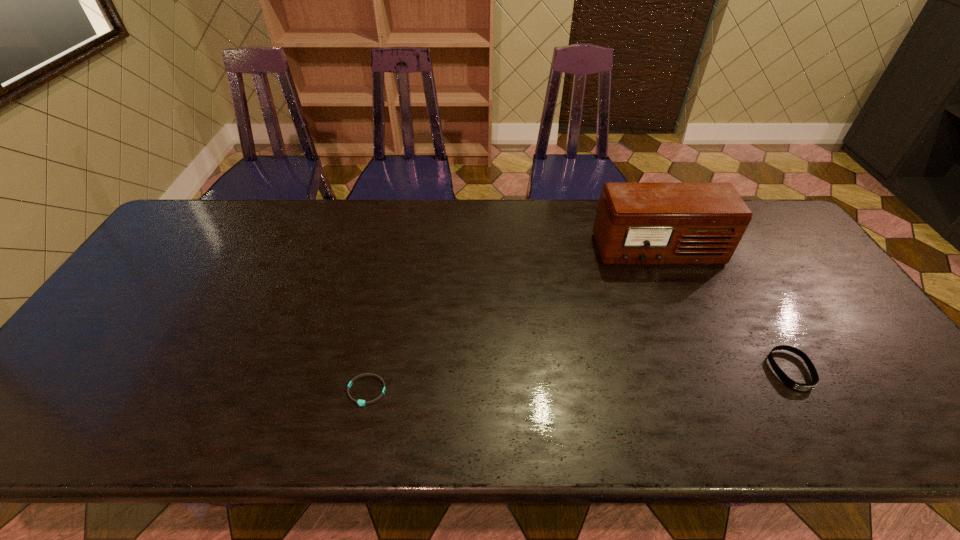
The image size is (960, 540). Find the location of `object present at the near edge`. object present at the near edge is located at coordinates (360, 402).

Where is `free spot at the far edge of the desktop`? This screenshot has height=540, width=960. free spot at the far edge of the desktop is located at coordinates (307, 211).

Identify the location of vacant space at the near edge of the desktop. The height and width of the screenshot is (540, 960). (264, 431).

Locate an element on the screen. blank space at the left edge of the desktop is located at coordinates (92, 360).

This screenshot has width=960, height=540. In the image, there is a desktop. What are the coordinates of `vacant space at the far left corner` in the screenshot? It's located at (236, 205).

I want to click on vacant space that's between the shortest object and the tallest object, so click(513, 321).

You are a GUI agent. You are given a task and a screenshot of the screen. Output one action in this format:
    pyautogui.click(x=<x>, y=<y>)
    Task: Click on the free spot between the second tallest object and the leftmost object
    Image resolution: width=960 pixels, height=540 pixels.
    Given the screenshot: What is the action you would take?
    pyautogui.click(x=579, y=381)

Find the location of a particular element. The image size is (960, 540). blank region between the second tallest object and the shortest object is located at coordinates (579, 381).

What are the coordinates of `free area in between the radio receiver and the left wristband` in the screenshot? It's located at (513, 321).

Where is `vacant region between the radio receiver and the taller wristband`? vacant region between the radio receiver and the taller wristband is located at coordinates (725, 311).